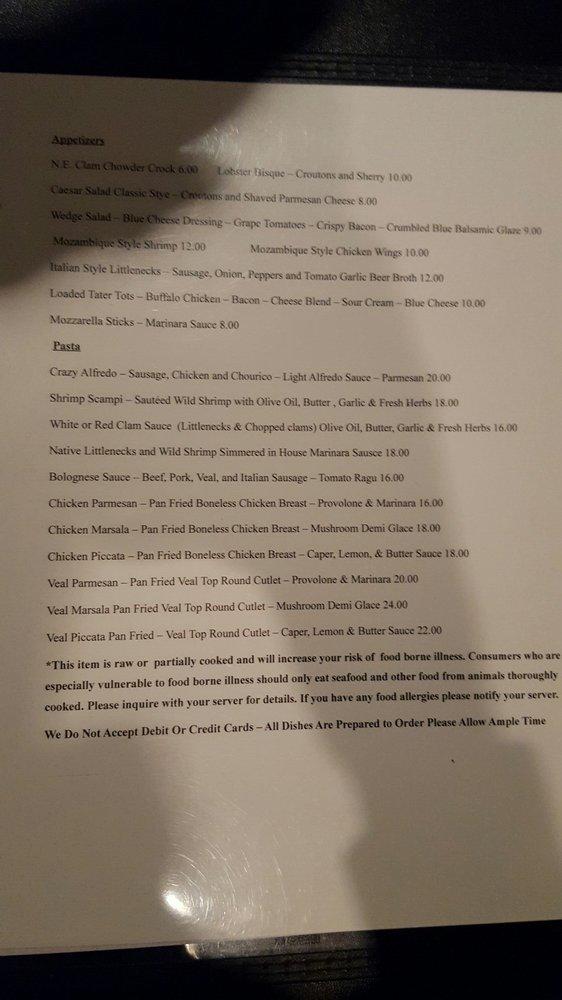
At what (x,y) coordinates should I click in order to perform the action: click on bottom light reflection. Please return your answer as a coordinate pair (x, y). Looking at the image, I should click on (221, 915), (312, 795), (212, 760).